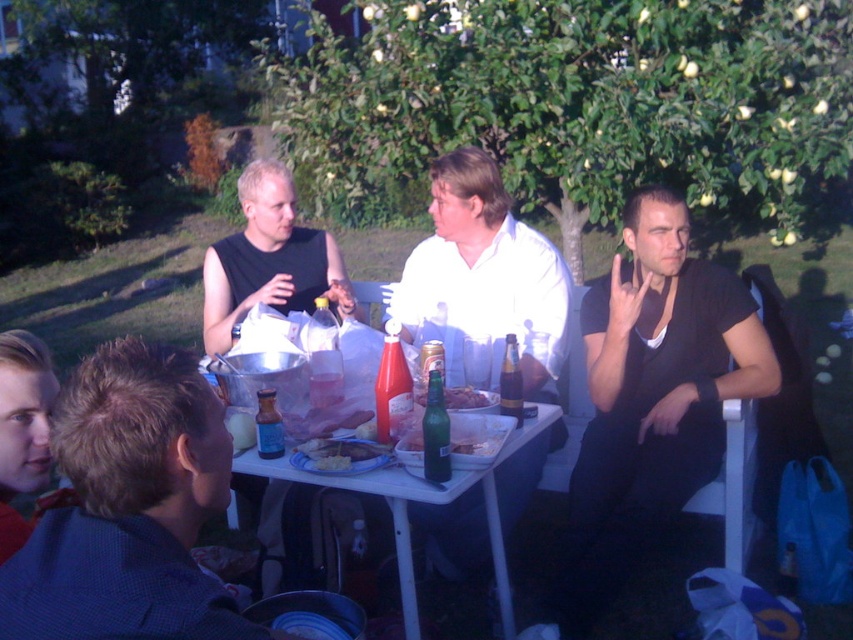
Can you confirm if green glass bottle at center is smaller than translucent plastic cup at center?

Incorrect, green glass bottle at center is not smaller in size than translucent plastic cup at center.

The image size is (853, 640). What are the coordinates of `green glass bottle at center` in the screenshot? It's located at (434, 432).

Is the position of green glass bottle at center more distant than that of white creamy food at table center?

No, it is not.

Which is in front, point (426, 461) or point (329, 465)?

Point (426, 461) is in front.

Is point (444, 481) positioned before point (322, 470)?

Yes, point (444, 481) is in front of point (322, 470).

Where is `green glass bottle at center`? green glass bottle at center is located at coordinates (434, 432).

Is brown hair at lower left to the right of translucent plastic bottle at center from the viewer's perspective?

No, brown hair at lower left is not to the right of translucent plastic bottle at center.

Can you confirm if brown hair at lower left is wider than translucent plastic bottle at center?

Indeed, brown hair at lower left has a greater width compared to translucent plastic bottle at center.

Who is more distant from viewer, (180, 483) or (392, 392)?

Point (392, 392)

Locate an element on the screen. brown hair at lower left is located at coordinates (129, 508).